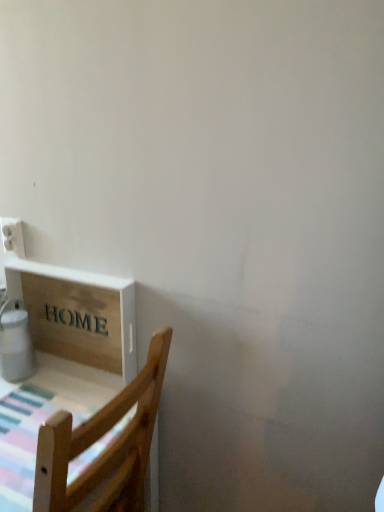
Question: Does white plastic electric outlet at upper left have a greater height compared to wooden sign at lower left?

Choices:
 (A) no
 (B) yes

Answer: (A)

Question: Can you confirm if white plastic electric outlet at upper left is bigger than wooden sign at lower left?

Choices:
 (A) no
 (B) yes

Answer: (A)

Question: Does white plastic electric outlet at upper left lie behind wooden sign at lower left?

Choices:
 (A) yes
 (B) no

Answer: (A)

Question: Is white plastic electric outlet at upper left smaller than wooden sign at lower left?

Choices:
 (A) no
 (B) yes

Answer: (B)

Question: Is white plastic electric outlet at upper left at the right side of wooden sign at lower left?

Choices:
 (A) no
 (B) yes

Answer: (A)

Question: Which is correct: white plastic electric outlet at upper left is inside wooden chair at lower left, or outside of it?

Choices:
 (A) outside
 (B) inside

Answer: (A)

Question: Is white plastic electric outlet at upper left in front of or behind wooden chair at lower left in the image?

Choices:
 (A) behind
 (B) front

Answer: (A)

Question: Considering the relative positions of white plastic electric outlet at upper left and wooden chair at lower left in the image provided, is white plastic electric outlet at upper left to the left or to the right of wooden chair at lower left?

Choices:
 (A) right
 (B) left

Answer: (A)

Question: Is point (0, 225) closer or farther from the camera than point (157, 394)?

Choices:
 (A) farther
 (B) closer

Answer: (A)

Question: Choose the correct answer: Is white plastic electric outlet at upper left inside wooden sign at lower left or outside it?

Choices:
 (A) inside
 (B) outside

Answer: (B)

Question: In the image, is white plastic electric outlet at upper left on the left side or the right side of wooden sign at lower left?

Choices:
 (A) left
 (B) right

Answer: (A)

Question: Is white plastic electric outlet at upper left taller or shorter than wooden sign at lower left?

Choices:
 (A) tall
 (B) short

Answer: (B)

Question: Is white plastic electric outlet at upper left in front of or behind wooden sign at lower left in the image?

Choices:
 (A) front
 (B) behind

Answer: (B)

Question: Considering the positions of white glossy water heater at lower left and wooden sign at lower left in the image, is white glossy water heater at lower left bigger or smaller than wooden sign at lower left?

Choices:
 (A) big
 (B) small

Answer: (B)

Question: Would you say white glossy water heater at lower left is to the left or to the right of wooden sign at lower left in the picture?

Choices:
 (A) right
 (B) left

Answer: (B)